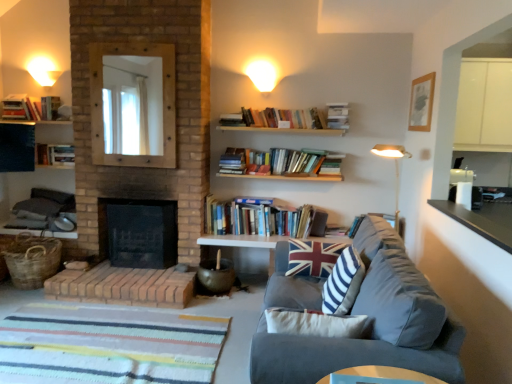
This screenshot has width=512, height=384. What are the coordinates of `empty space that is ontop of wooden mirror at upper left (from a real-world perspective)` in the screenshot? It's located at (131, 45).